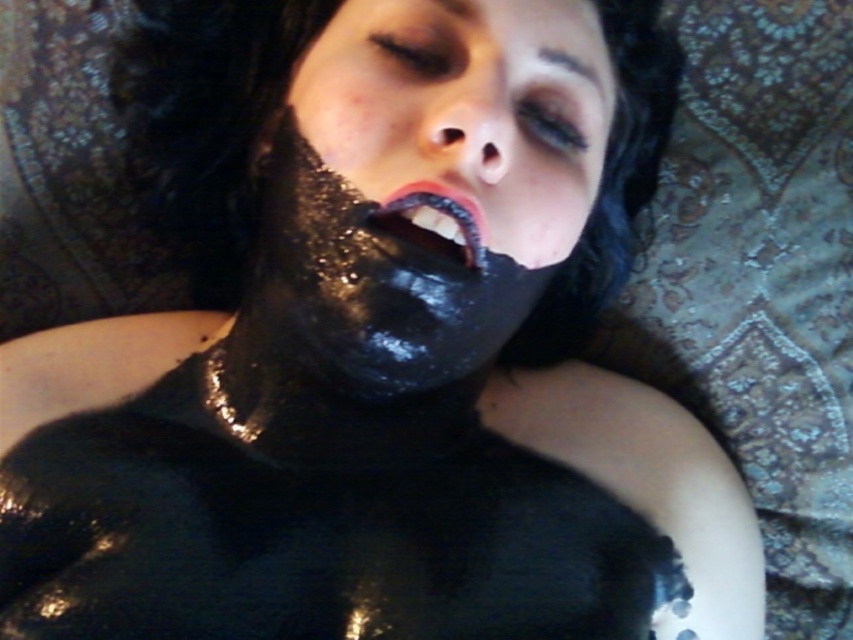
You are a skincare specialist observing a client with a black matte mask at center and shiny black lips at center. Which object is located to the right of the other?

The black matte mask at center is positioned on the right side of shiny black lips at center.

You are a photographer standing at a distance from the black matte mask at center. You want to take a closeup photo of the mask without getting too close. What is the minimum distance you need to be from the mask to capture it clearly?

The black matte mask at center is 20.67 inches away from the viewer. To take a closeup photo without getting too close, you need to be at least 20.67 inches away from the mask to ensure it fills the frame properly.